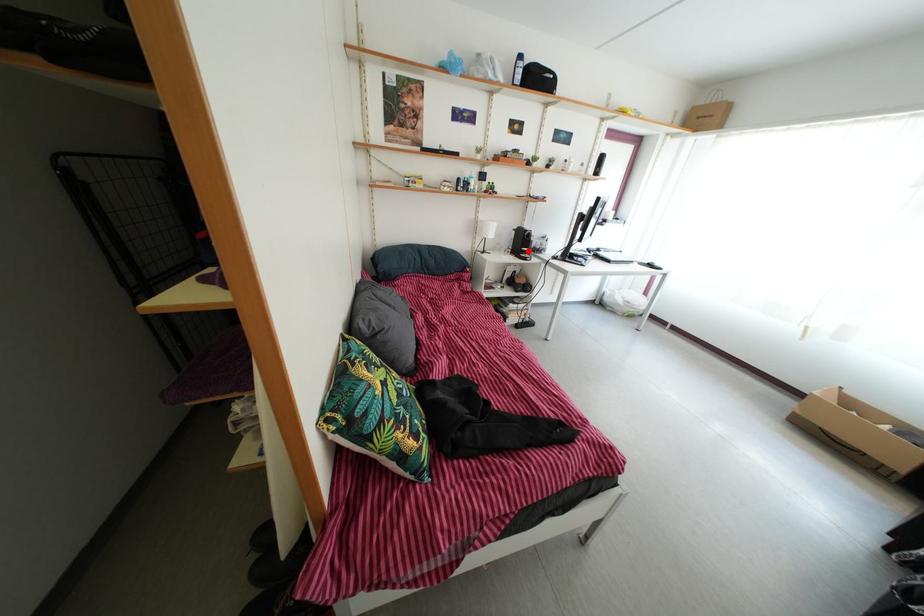
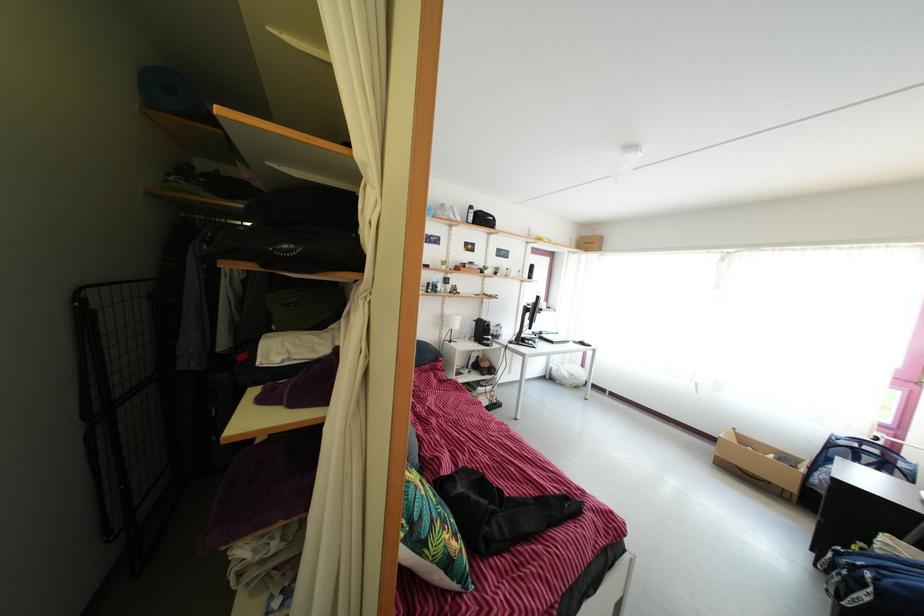
Question: I am providing you with two images of the same scene from different viewpoints. Given a red point in image1, look at the same physical point in image2. Is it:

Choices:
 (A) Closer to the viewpoint
 (B) Farther from the viewpoint

Answer: (B)